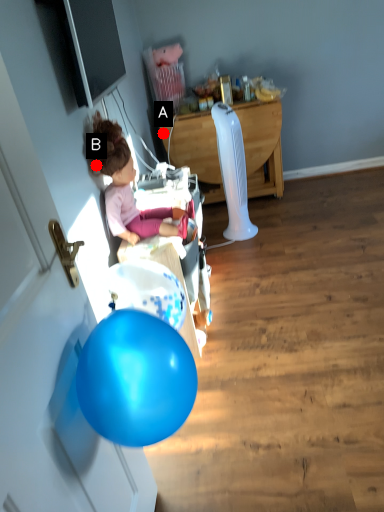
Question: Two points are circled on the image, labeled by A and B beside each circle. Which of the following is the closest to the observer?

Choices:
 (A) A is closer
 (B) B is closer

Answer: (B)